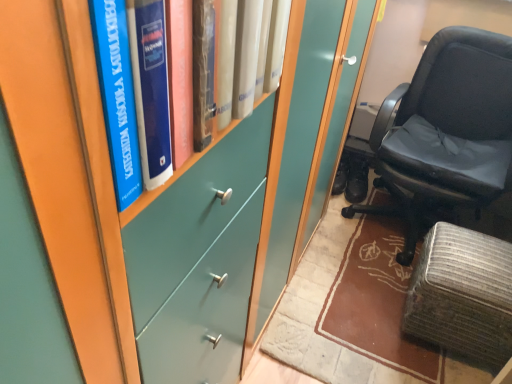
Question: Looking at their shapes, would you say textured gray ottoman at lower right is wider or thinner than black leather chair at right?

Choices:
 (A) thin
 (B) wide

Answer: (A)

Question: In the image, is textured gray ottoman at lower right on the left side or the right side of black leather chair at right?

Choices:
 (A) right
 (B) left

Answer: (B)

Question: Which of these objects is positioned closest to the black leather chair at right?

Choices:
 (A) textured gray ottoman at lower right
 (B) blue hardcover book at left

Answer: (A)

Question: Which object is positioned closest to the black leather chair at right?

Choices:
 (A) textured gray ottoman at lower right
 (B) blue hardcover book at left

Answer: (A)